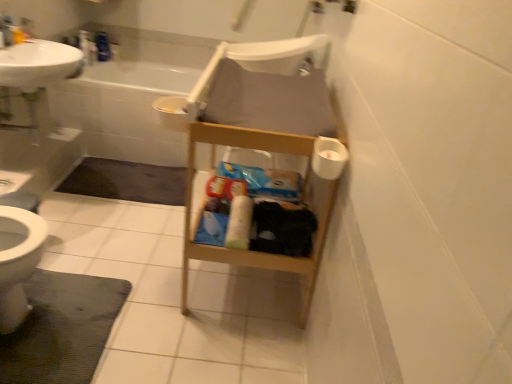
How much space does white matte toilet paper at right, arranged as the first toilet paper when viewed from the right, occupy vertically?

white matte toilet paper at right, arranged as the first toilet paper when viewed from the right, is 3.65 inches in height.

Locate an element on the screen. Image resolution: width=512 pixels, height=384 pixels. dark gray textured bath mat at lower left, acting as the second bath mat starting from the top is located at coordinates (62, 328).

What is the approximate width of dark gray carpet at lower left, which is the 1th bath mat in back-to-front order?

dark gray carpet at lower left, which is the 1th bath mat in back-to-front order, is 20.57 inches wide.

What is the approximate width of white matte toilet paper at center, which is counted as the 2th toilet paper, starting from the front?

It is 12.04 centimeters.

The height and width of the screenshot is (384, 512). Identify the location of white matte toilet paper at right, arranged as the first toilet paper when viewed from the right. (329, 158).

Is white glossy sink at upper left positioned beyond the bounds of dark gray carpet at lower left, placed as the 2th bath mat when sorted from front to back?

Yes, white glossy sink at upper left is outside of dark gray carpet at lower left, placed as the 2th bath mat when sorted from front to back.

Based on the photo, from a real-world perspective, which is physically above, white glossy sink at upper left or dark gray carpet at lower left, arranged as the 1th bath mat when viewed from the top?

From a 3D spatial view, white glossy sink at upper left is above.

From a real-world perspective, starting from the white glossy sink at upper left, which bath mat is the 2nd one below it? Please provide its 2D coordinates.

[(126, 181)]

In the scene shown: Is white matte toilet paper at center, the second toilet paper in the right-to-left sequence, surrounding dark gray carpet at lower left, placed as the 2th bath mat when sorted from front to back?

No, dark gray carpet at lower left, placed as the 2th bath mat when sorted from front to back, is located outside of white matte toilet paper at center, the second toilet paper in the right-to-left sequence.

Considering the relative sizes of white matte toilet paper at center, which is counted as the 2th toilet paper, starting from the front, and dark gray carpet at lower left, which is the 1th bath mat in back-to-front order, in the image provided, is white matte toilet paper at center, which is counted as the 2th toilet paper, starting from the front, thinner than dark gray carpet at lower left, which is the 1th bath mat in back-to-front order,?

Correct, the width of white matte toilet paper at center, which is counted as the 2th toilet paper, starting from the front, is less than that of dark gray carpet at lower left, which is the 1th bath mat in back-to-front order.

Locate an element on the screen. Image resolution: width=512 pixels, height=384 pixels. bath mat behind the white matte toilet paper at center, which ranks as the first toilet paper in left-to-right order is located at coordinates (126, 181).

From the image's perspective, does white matte toilet paper at center, the second toilet paper positioned from the top, appear lower than dark gray carpet at lower left, placed as the 2th bath mat when sorted from front to back?

Yes, from the image's perspective, white matte toilet paper at center, the second toilet paper positioned from the top, is beneath dark gray carpet at lower left, placed as the 2th bath mat when sorted from front to back.

Which is more to the left, white plastic chair at center or dark gray textured bath mat at lower left, the 1th bath mat when ordered from front to back?

dark gray textured bath mat at lower left, the 1th bath mat when ordered from front to back.

Is white plastic chair at center situated inside dark gray textured bath mat at lower left, the 1th bath mat when ordered from front to back, or outside?

white plastic chair at center lies outside dark gray textured bath mat at lower left, the 1th bath mat when ordered from front to back.

Is white plastic chair at center turned away from dark gray textured bath mat at lower left, the 2th bath mat in the back-to-front sequence?

No, white plastic chair at center is not facing the opposite direction of dark gray textured bath mat at lower left, the 2th bath mat in the back-to-front sequence.

From a real-world perspective, does white plastic chair at center sit lower than dark gray textured bath mat at lower left, the 1th bath mat when ordered from front to back?

Actually, white plastic chair at center is physically above dark gray textured bath mat at lower left, the 1th bath mat when ordered from front to back, in the real world.

Which object is closer to the camera taking this photo, dark gray textured bath mat at lower left, the 2th bath mat in the back-to-front sequence, or white matte toilet paper at center, the second toilet paper in the right-to-left sequence?

dark gray textured bath mat at lower left, the 2th bath mat in the back-to-front sequence.

In the image, is dark gray textured bath mat at lower left, acting as the second bath mat starting from the top, on the left side or the right side of white matte toilet paper at center, which ranks as the first toilet paper in left-to-right order?

In the image, dark gray textured bath mat at lower left, acting as the second bath mat starting from the top, appears on the left side of white matte toilet paper at center, which ranks as the first toilet paper in left-to-right order.

Is dark gray textured bath mat at lower left, the 1th bath mat when ordered from front to back, bigger than white matte toilet paper at center, placed as the 1th toilet paper when sorted from bottom to top?

Yes.

Is dark gray textured bath mat at lower left, the 2th bath mat in the back-to-front sequence, looking in the opposite direction of white matte toilet paper at center, which ranks as the first toilet paper in left-to-right order?

dark gray textured bath mat at lower left, the 2th bath mat in the back-to-front sequence, does not have its back to white matte toilet paper at center, which ranks as the first toilet paper in left-to-right order.

From the image's perspective, is white matte toilet paper at center, which ranks as the first toilet paper in left-to-right order, located above white matte toilet paper at right, the 2th toilet paper positioned from the bottom?

No, from the image's perspective, white matte toilet paper at center, which ranks as the first toilet paper in left-to-right order, is not above white matte toilet paper at right, the 2th toilet paper positioned from the bottom.

Considering the relative sizes of white matte toilet paper at center, the second toilet paper in the right-to-left sequence, and white matte toilet paper at right, positioned as the 2th toilet paper in left-to-right order, in the image provided, is white matte toilet paper at center, the second toilet paper in the right-to-left sequence, smaller than white matte toilet paper at right, positioned as the 2th toilet paper in left-to-right order,?

Incorrect, white matte toilet paper at center, the second toilet paper in the right-to-left sequence, is not smaller in size than white matte toilet paper at right, positioned as the 2th toilet paper in left-to-right order.

Measure the distance between white matte toilet paper at center, which ranks as the first toilet paper in left-to-right order, and white matte toilet paper at right, which ranks as the second toilet paper in back-to-front order.

The distance of white matte toilet paper at center, which ranks as the first toilet paper in left-to-right order, from white matte toilet paper at right, which ranks as the second toilet paper in back-to-front order, is 19.43 inches.

From a real-world perspective, is white matte toilet paper at center, the second toilet paper positioned from the top, physically above white matte toilet paper at right, the 1th toilet paper viewed from the top?

A: No.

From the image's perspective, is dark gray carpet at lower left, arranged as the 1th bath mat when viewed from the top, below white glossy sink at upper left?

Yes, from the image's perspective, dark gray carpet at lower left, arranged as the 1th bath mat when viewed from the top, is beneath white glossy sink at upper left.

Based on the photo, choose the correct answer: Is dark gray carpet at lower left, arranged as the 1th bath mat when viewed from the top, inside white glossy sink at upper left or outside it?

dark gray carpet at lower left, arranged as the 1th bath mat when viewed from the top, is located beyond the bounds of white glossy sink at upper left.

Is dark gray carpet at lower left, which is the 1th bath mat in back-to-front order, far away from white glossy sink at upper left?

That's not correct — dark gray carpet at lower left, which is the 1th bath mat in back-to-front order, is a little close to white glossy sink at upper left.

From a real-world perspective, which is physically below, dark gray carpet at lower left, arranged as the 1th bath mat when viewed from the top, or white glossy sink at upper left?

dark gray carpet at lower left, arranged as the 1th bath mat when viewed from the top, is physically lower.

From a real-world perspective, which object rests below the other?

white glossy sink at upper left, from a real-world perspective.

Is white glossy sink at upper left facing towards white matte toilet paper at right, the 1th toilet paper viewed from the top?

Yes, white glossy sink at upper left is turned towards white matte toilet paper at right, the 1th toilet paper viewed from the top.

In terms of width, does white glossy sink at upper left look wider or thinner when compared to white matte toilet paper at right, the 1th toilet paper when ordered from front to back?

white glossy sink at upper left is wider than white matte toilet paper at right, the 1th toilet paper when ordered from front to back.

Can you confirm if white glossy sink at upper left is taller than white matte toilet paper at right, arranged as the first toilet paper when viewed from the right?

Yes, white glossy sink at upper left is taller than white matte toilet paper at right, arranged as the first toilet paper when viewed from the right.

Identify the location of sink above the dark gray carpet at lower left, arranged as the 1th bath mat when viewed from the top (from a real-world perspective). The width and height of the screenshot is (512, 384). (38, 64).

Identify the location of bath mat behind the white matte toilet paper at center, the 1th toilet paper from the back. (126, 181).

From the image, which object appears to be nearer to white glossy sink at upper left, dark gray textured bath mat at lower left, the 1th bath mat when ordered from front to back, or white plastic chair at center?

white plastic chair at center lies closer to white glossy sink at upper left than the other object.

When comparing their distances from white glossy sink at upper left, does dark gray textured bath mat at lower left, which is the 1th bath mat from bottom to top, or white matte toilet paper at right, the 1th toilet paper when ordered from front to back, seem further?

white matte toilet paper at right, the 1th toilet paper when ordered from front to back.

When comparing their distances from white matte toilet paper at center, the 1th toilet paper from the back, does white glossy sink at upper left or white matte toilet paper at right, the 1th toilet paper when ordered from front to back, seem closer?

white matte toilet paper at right, the 1th toilet paper when ordered from front to back.

Which object lies further to the anchor point white matte toilet paper at center, the second toilet paper in the right-to-left sequence, white plastic chair at center or dark gray carpet at lower left, which is the 1th bath mat in back-to-front order?

white plastic chair at center.

Estimate the real-world distances between objects in this image. Which object is further from white plastic chair at center, white glossy sink at upper left or white matte toilet paper at center, the second toilet paper positioned from the top?

The object further to white plastic chair at center is white matte toilet paper at center, the second toilet paper positioned from the top.

Looking at the image, which one is located closer to white matte toilet paper at center, placed as the 1th toilet paper when sorted from bottom to top, white glossy sink at upper left or dark gray textured bath mat at lower left, the 1th bath mat when ordered from front to back?

dark gray textured bath mat at lower left, the 1th bath mat when ordered from front to back.

Which object lies nearer to the anchor point white matte toilet paper at center, which ranks as the first toilet paper in left-to-right order, white matte toilet paper at right, arranged as the first toilet paper when viewed from the right, or white glossy sink at upper left?

The object closer to white matte toilet paper at center, which ranks as the first toilet paper in left-to-right order, is white matte toilet paper at right, arranged as the first toilet paper when viewed from the right.

Looking at the image, which one is located closer to dark gray carpet at lower left, which is the 1th bath mat in back-to-front order, white matte toilet paper at right, the 1th toilet paper viewed from the top, or white matte toilet paper at center, placed as the 1th toilet paper when sorted from bottom to top?

white matte toilet paper at center, placed as the 1th toilet paper when sorted from bottom to top, lies closer to dark gray carpet at lower left, which is the 1th bath mat in back-to-front order, than the other object.

Where is `sink between white matte toilet paper at center, the second toilet paper positioned from the top, and white plastic chair at center in the front-back direction`? The image size is (512, 384). sink between white matte toilet paper at center, the second toilet paper positioned from the top, and white plastic chair at center in the front-back direction is located at coordinates (38, 64).

The image size is (512, 384). I want to click on toilet paper between dark gray textured bath mat at lower left, acting as the second bath mat starting from the top, and white plastic chair at center from front to back, so click(x=239, y=223).

Identify the location of toilet paper between dark gray textured bath mat at lower left, the 2th bath mat in the back-to-front sequence, and dark gray carpet at lower left, the 2th bath mat positioned from the bottom, along the z-axis. The height and width of the screenshot is (384, 512). (239, 223).

At what (x,y) coordinates should I click in order to perform the action: click on bath mat between white matte toilet paper at center, placed as the 1th toilet paper when sorted from bottom to top, and white plastic chair at center in the front-back direction. Please return your answer as a coordinate pair (x, y). The width and height of the screenshot is (512, 384). Looking at the image, I should click on (126, 181).